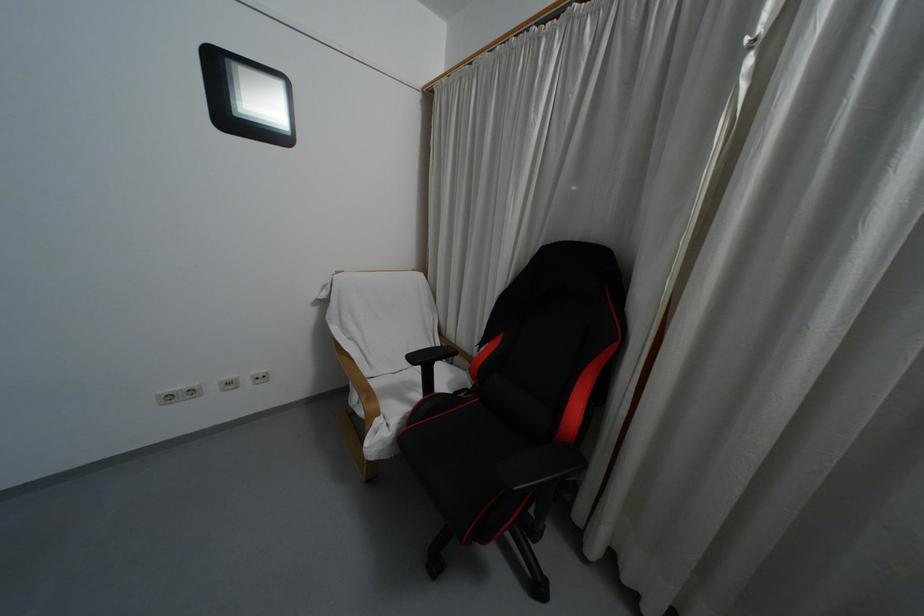
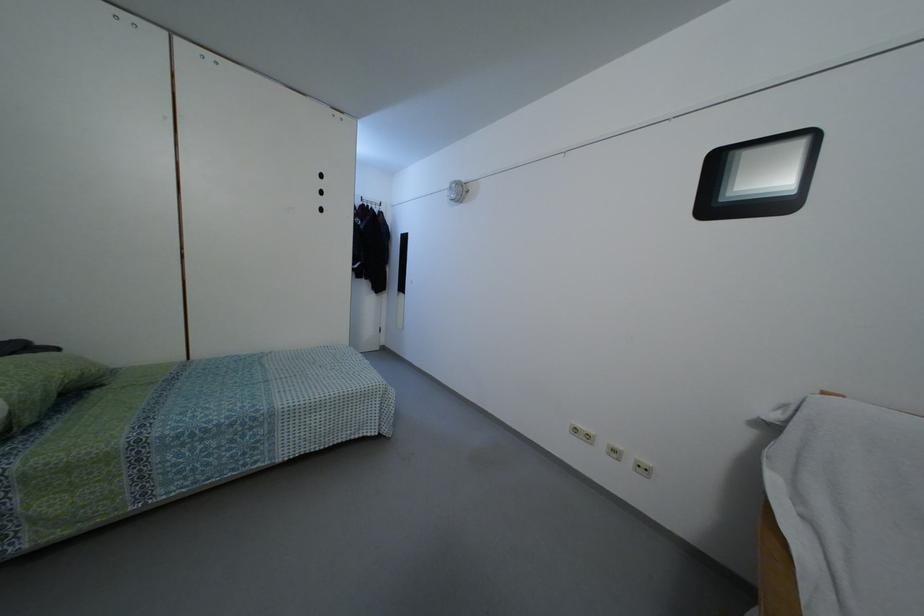
Find the pixel in the second image that matches point (229, 386) in the first image.

(614, 456)